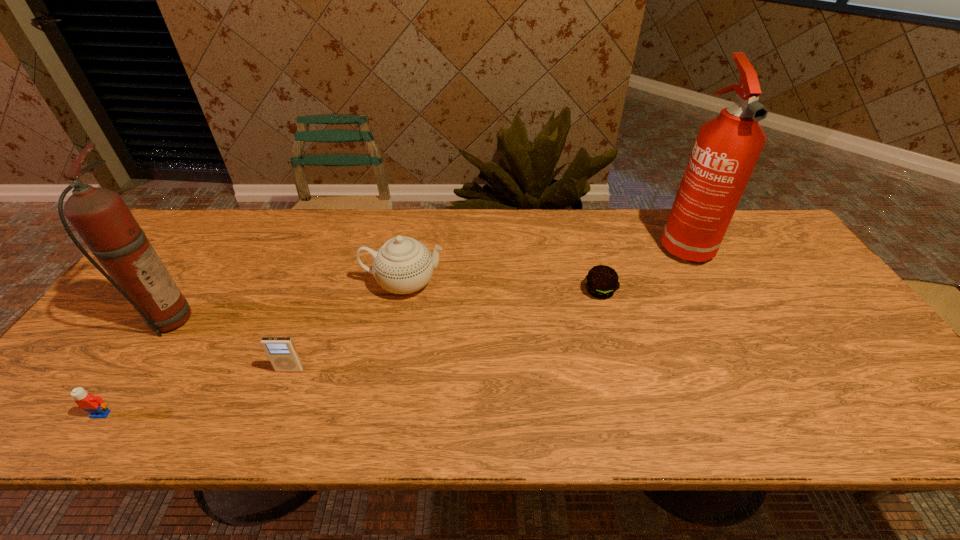
At what (x,y) coordinates should I click in order to perform the action: click on the right fire extinguisher. Please return your answer as a coordinate pair (x, y). This screenshot has width=960, height=540. Looking at the image, I should click on (726, 150).

The image size is (960, 540). I want to click on the rightmost object, so click(x=726, y=150).

Find the location of `the fifth shortest object`. the fifth shortest object is located at coordinates [100, 216].

The height and width of the screenshot is (540, 960). I want to click on the left fire extinguisher, so click(x=100, y=216).

This screenshot has width=960, height=540. Find the location of `chinaware`. chinaware is located at coordinates (403, 265).

Locate an element on the screen. the third object from right to left is located at coordinates (403, 265).

Image resolution: width=960 pixels, height=540 pixels. In order to click on the second nearest object in this screenshot , I will do `click(281, 351)`.

The height and width of the screenshot is (540, 960). I want to click on the third shortest object, so (x=281, y=351).

Locate an element on the screen. This screenshot has height=540, width=960. the nearest object is located at coordinates (94, 405).

Locate an element on the screen. Lego is located at coordinates (94, 405).